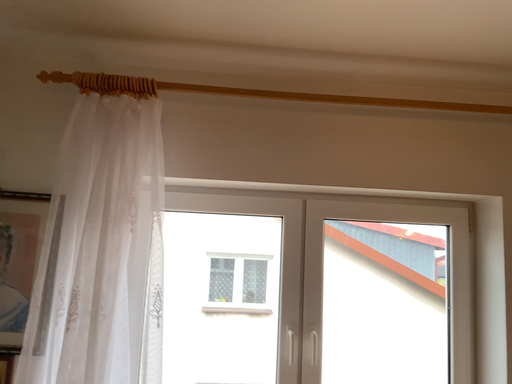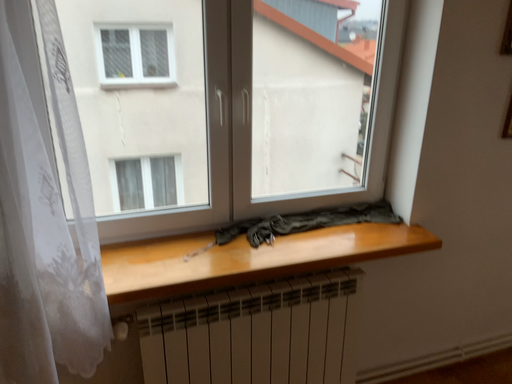
Question: Which way did the camera rotate in the video?

Choices:
 (A) rotated downward
 (B) rotated upward

Answer: (A)